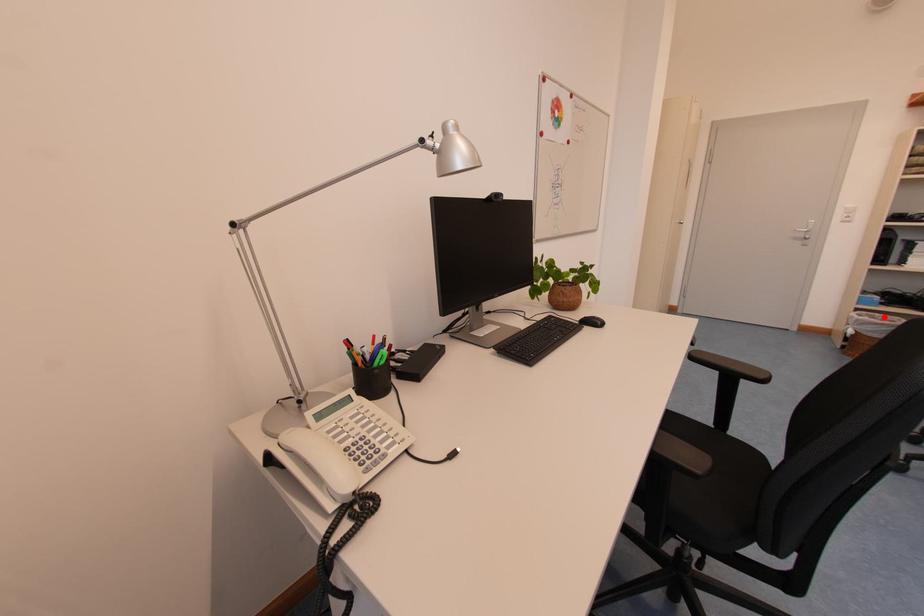
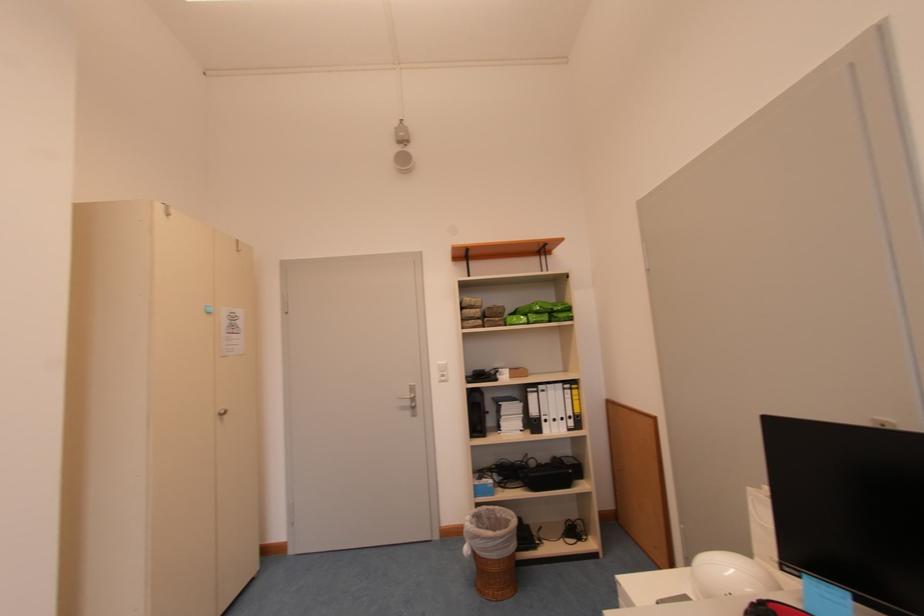
Where in the second image is the point corresponding to the highlighted location from the first image?

(504, 509)